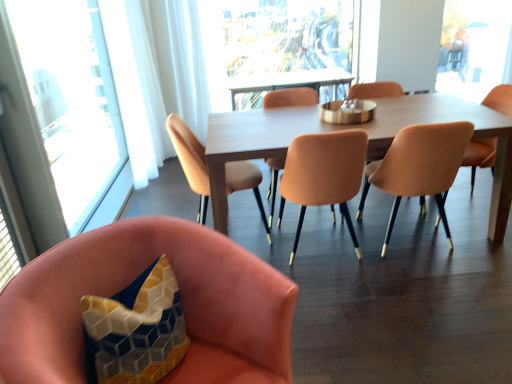
Question: Is point (312, 104) closer or farther from the camera than point (244, 162)?

Choices:
 (A) closer
 (B) farther

Answer: (B)

Question: Would you say matte orange chair at center, which is counted as the 3th chair, starting from the left, is inside or outside matte peach chair at center, marked as the second chair in a left-to-right arrangement?

Choices:
 (A) outside
 (B) inside

Answer: (A)

Question: Considering the real-world distances, which object is farthest from the matte peach chair at center, the 6th chair viewed from the left?

Choices:
 (A) transparent glass window at left, the first window from the left
 (B) transparent glass window screen at upper right
 (C) velvet pink chair at lower left, positioned as the 1th chair in left-to-right order
 (D) transparent glass window at center, acting as the 2th window starting from the left
 (E) light brown wooden table at center

Answer: (B)

Question: Which object is the farthest from the matte orange chair at center, which appears as the second chair when viewed from the right?

Choices:
 (A) matte peach armchair at center
 (B) velvet pink chair at lower left, the 6th chair in the right-to-left sequence
 (C) matte orange chair at center, which appears as the third chair when viewed from the right
 (D) matte peach chair at center, which ranks as the 1th chair in right-to-left order
 (E) light brown wooden table at center

Answer: (B)